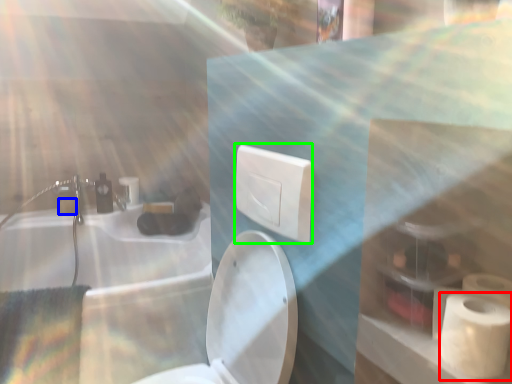
Question: Estimate the real-world distances between objects in this image. Which object is farther from toiletry bag (highlighted by a red box), toilet paper (highlighted by a blue box) or electric outlet (highlighted by a green box)?

Choices:
 (A) toilet paper
 (B) electric outlet

Answer: (A)